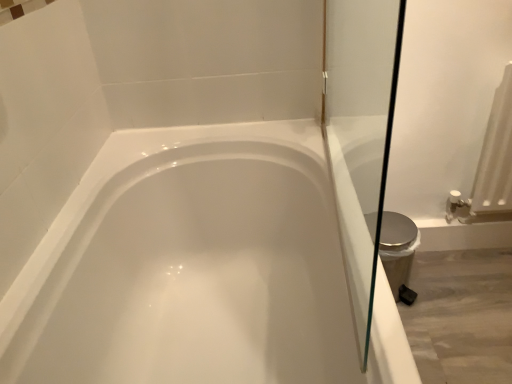
This screenshot has height=384, width=512. What are the coordinates of `white glossy bathtub at center` in the screenshot? It's located at point(197,269).

What do you see at coordinates (197, 269) in the screenshot? The height and width of the screenshot is (384, 512). I see `white glossy bathtub at center` at bounding box center [197, 269].

This screenshot has height=384, width=512. Describe the element at coordinates (398, 251) in the screenshot. I see `silver metallic bidet at right` at that location.

At what (x,y) coordinates should I click in order to perform the action: click on silver metallic bidet at right. Please return your answer as a coordinate pair (x, y). Looking at the image, I should click on (398, 251).

Locate an element on the screen. white glossy bathtub at center is located at coordinates (197, 269).

Does silver metallic bidet at right appear on the left side of white glossy bathtub at center?

In fact, silver metallic bidet at right is to the right of white glossy bathtub at center.

Relative to white glossy bathtub at center, is silver metallic bidet at right in front or behind?

Clearly, silver metallic bidet at right is behind white glossy bathtub at center.

Which is behind, point (367, 225) or point (205, 198)?

Positioned behind is point (205, 198).

From the image's perspective, is silver metallic bidet at right above or below white glossy bathtub at center?

From the image's perspective, silver metallic bidet at right appears above white glossy bathtub at center.

From a real-world perspective, is silver metallic bidet at right physically below white glossy bathtub at center?

Yes, from a real-world perspective, silver metallic bidet at right is under white glossy bathtub at center.

Which of these two, silver metallic bidet at right or white glossy bathtub at center, is wider?

Wider between the two is white glossy bathtub at center.

Considering the sizes of objects silver metallic bidet at right and white glossy bathtub at center in the image provided, who is taller, silver metallic bidet at right or white glossy bathtub at center?

white glossy bathtub at center is taller.

Based on their sizes in the image, would you say silver metallic bidet at right is bigger or smaller than white glossy bathtub at center?

Considering their sizes, silver metallic bidet at right takes up less space than white glossy bathtub at center.

Is silver metallic bidet at right completely or partially outside of white glossy bathtub at center?

Yes.

Is silver metallic bidet at right next to white glossy bathtub at center and touching it?

silver metallic bidet at right is not next to white glossy bathtub at center, and they're not touching.

Is silver metallic bidet at right aimed at white glossy bathtub at center?

No, silver metallic bidet at right is not aimed at white glossy bathtub at center.

Measure the distance between silver metallic bidet at right and white glossy bathtub at center.

silver metallic bidet at right and white glossy bathtub at center are 62.29 centimeters apart from each other.

Locate an element on the screen. bidet located behind the white glossy bathtub at center is located at coordinates (398, 251).

Considering the positions of objects white glossy bathtub at center and silver metallic bidet at right in the image provided, who is more to the right, white glossy bathtub at center or silver metallic bidet at right?

silver metallic bidet at right is more to the right.

In the scene shown: Is the depth of white glossy bathtub at center greater than that of silver metallic bidet at right?

No.

Is point (199, 204) farther from viewer compared to point (381, 239)?

No, it is not.

From the image's perspective, between white glossy bathtub at center and silver metallic bidet at right, who is located below?

white glossy bathtub at center, from the image's perspective.

From a real-world perspective, is white glossy bathtub at center physically located above or below silver metallic bidet at right?

white glossy bathtub at center is situated higher than silver metallic bidet at right in the real world.

Does white glossy bathtub at center have a lesser width compared to silver metallic bidet at right?

In fact, white glossy bathtub at center might be wider than silver metallic bidet at right.

Who is taller, white glossy bathtub at center or silver metallic bidet at right?

Standing taller between the two is white glossy bathtub at center.

Does white glossy bathtub at center have a smaller size compared to silver metallic bidet at right?

Incorrect, white glossy bathtub at center is not smaller in size than silver metallic bidet at right.

Is white glossy bathtub at center not within silver metallic bidet at right?

That's correct, white glossy bathtub at center is outside of silver metallic bidet at right.

Are white glossy bathtub at center and silver metallic bidet at right far apart?

That's not correct — white glossy bathtub at center is a little close to silver metallic bidet at right.

Is white glossy bathtub at center aimed at silver metallic bidet at right?

Yes, white glossy bathtub at center is aimed at silver metallic bidet at right.

What's the angular difference between white glossy bathtub at center and silver metallic bidet at right's facing directions?

They differ by 87.3 degrees in their facing directions.

The width and height of the screenshot is (512, 384). In order to click on bathtub that is in front of the silver metallic bidet at right in this screenshot , I will do `click(197, 269)`.

Locate an element on the screen. This screenshot has height=384, width=512. bidet behind the white glossy bathtub at center is located at coordinates (398, 251).

Find the location of a particular element. The height and width of the screenshot is (384, 512). bathtub located in front of the silver metallic bidet at right is located at coordinates (197, 269).